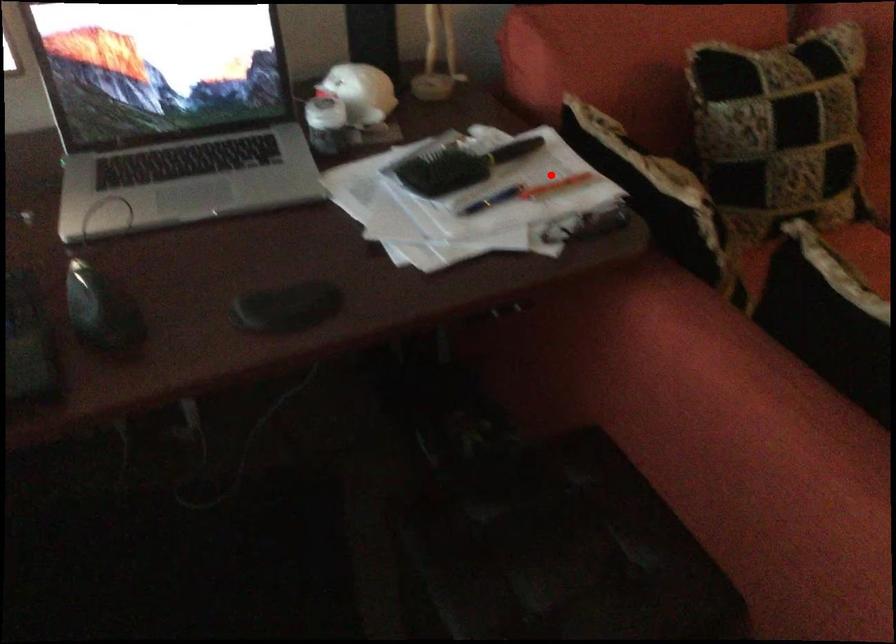
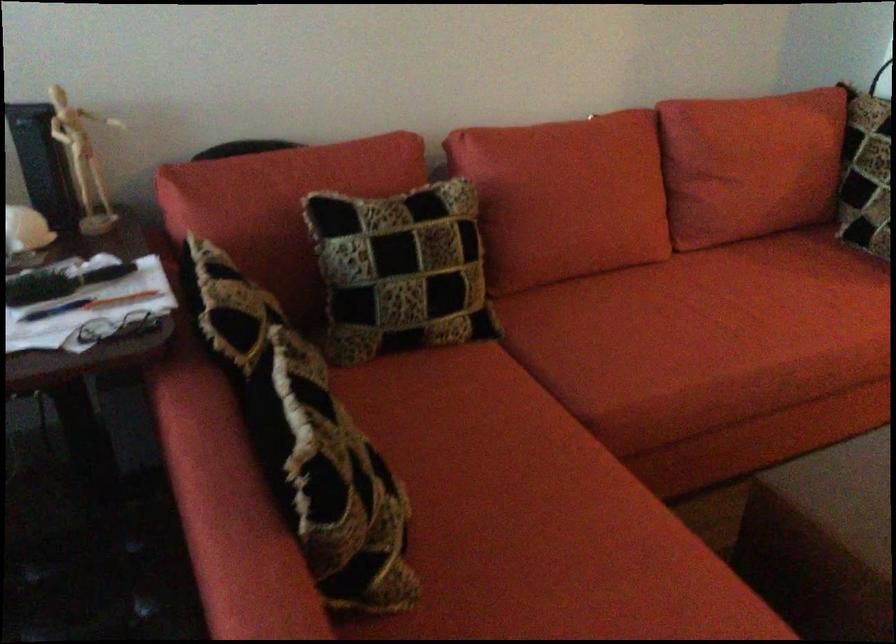
Find the pixel in the second image that matches the highlighted location in the first image.

(122, 299)